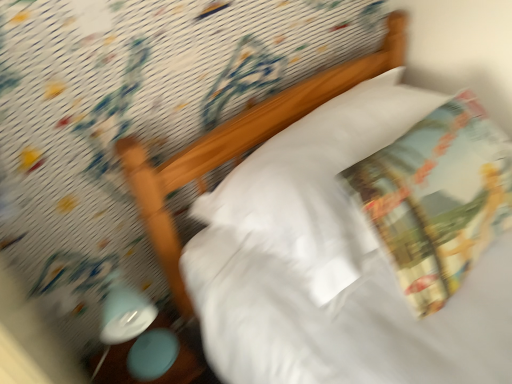
Question: Is matte blue lamp at lower left at the right side of printed fabric throw pillow at upper right?

Choices:
 (A) no
 (B) yes

Answer: (A)

Question: From a real-world perspective, is matte blue lamp at lower left positioned over printed fabric throw pillow at upper right based on gravity?

Choices:
 (A) no
 (B) yes

Answer: (A)

Question: From the image's perspective, does matte blue lamp at lower left appear higher than printed fabric throw pillow at upper right?

Choices:
 (A) yes
 (B) no

Answer: (B)

Question: Can you confirm if matte blue lamp at lower left is shorter than printed fabric throw pillow at upper right?

Choices:
 (A) no
 (B) yes

Answer: (A)

Question: Considering the relative positions of matte blue lamp at lower left and printed fabric throw pillow at upper right in the image provided, is matte blue lamp at lower left in front of printed fabric throw pillow at upper right?

Choices:
 (A) yes
 (B) no

Answer: (B)

Question: From the image's perspective, is white soft pillow at upper center located above or below printed fabric throw pillow at upper right?

Choices:
 (A) above
 (B) below

Answer: (A)

Question: In terms of width, does white soft pillow at upper center look wider or thinner when compared to printed fabric throw pillow at upper right?

Choices:
 (A) thin
 (B) wide

Answer: (B)

Question: Considering the positions of white soft pillow at upper center and printed fabric throw pillow at upper right in the image, is white soft pillow at upper center bigger or smaller than printed fabric throw pillow at upper right?

Choices:
 (A) small
 (B) big

Answer: (B)

Question: From a real-world perspective, relative to printed fabric throw pillow at upper right, is white soft pillow at upper center vertically above or below?

Choices:
 (A) above
 (B) below

Answer: (B)

Question: Considering their positions, is matte blue lamp at lower left located in front of or behind white soft pillow at upper center?

Choices:
 (A) front
 (B) behind

Answer: (B)

Question: Looking at the image, does matte blue lamp at lower left seem bigger or smaller compared to white soft pillow at upper center?

Choices:
 (A) big
 (B) small

Answer: (B)

Question: Is matte blue lamp at lower left to the left or to the right of white soft pillow at upper center in the image?

Choices:
 (A) left
 (B) right

Answer: (A)

Question: In terms of height, does matte blue lamp at lower left look taller or shorter compared to white soft pillow at upper center?

Choices:
 (A) tall
 (B) short

Answer: (A)

Question: Is matte blue lamp at lower left inside or outside of matte plastic table at lower left?

Choices:
 (A) outside
 (B) inside

Answer: (A)

Question: In terms of size, does matte blue lamp at lower left appear bigger or smaller than matte plastic table at lower left?

Choices:
 (A) small
 (B) big

Answer: (A)